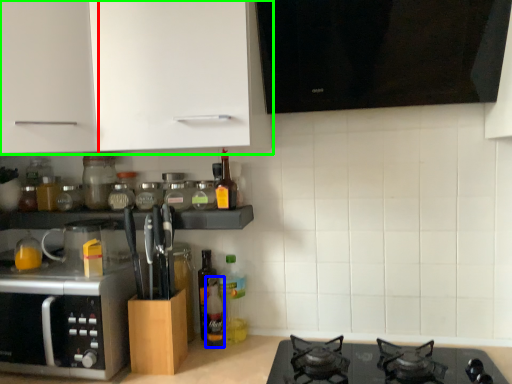
Question: Which is farther away from cabinetry (highlighted by a red box)? bottle (highlighted by a blue box) or cabinetry (highlighted by a green box)?

Choices:
 (A) bottle
 (B) cabinetry

Answer: (A)